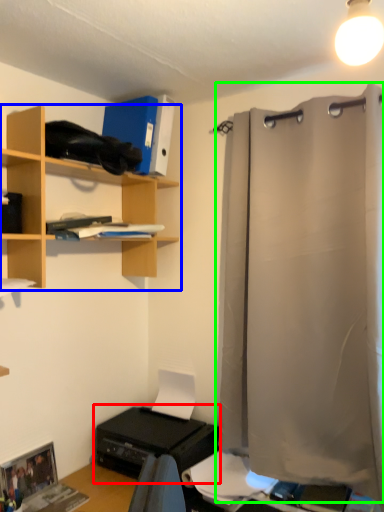
Question: Which object is positioned farthest from printer (highlighted by a red box)? Select from shelf (highlighted by a blue box) and shower curtain (highlighted by a green box).

Choices:
 (A) shelf
 (B) shower curtain

Answer: (A)